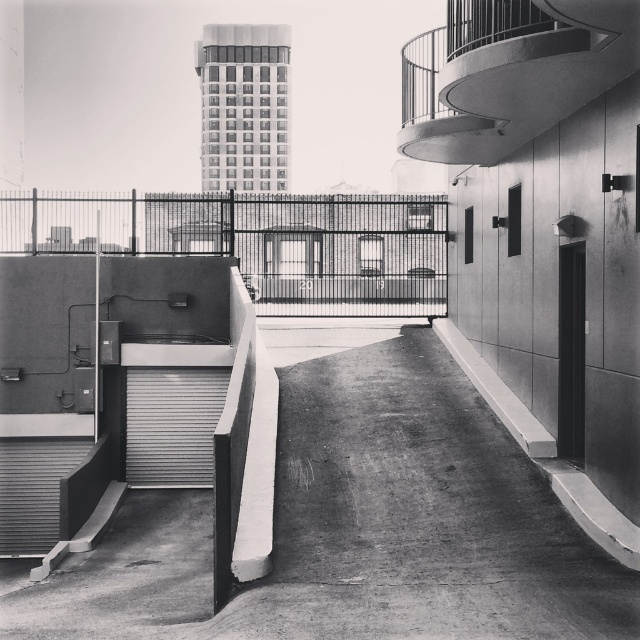
Question: Which point appears farthest from the camera in this image?

Choices:
 (A) (136, 477)
 (B) (467, 100)
 (C) (28, 508)

Answer: (A)

Question: Is metallic spiral staircase at upper right positioned in front of metallic gray stairwell at lower left?

Choices:
 (A) no
 (B) yes

Answer: (B)

Question: Can you confirm if metallic spiral staircase at upper right is thinner than metallic gray stairwell at lower left?

Choices:
 (A) no
 (B) yes

Answer: (B)

Question: Which object is farther from the camera taking this photo?

Choices:
 (A) metallic gray stairwell at lower left
 (B) metallic spiral staircase at upper right

Answer: (A)

Question: Is metallic spiral staircase at upper right wider than metallic silver door at lower left?

Choices:
 (A) no
 (B) yes

Answer: (A)

Question: Among these objects, which one is farthest from the camera?

Choices:
 (A) metallic gray stairwell at lower left
 (B) metallic spiral staircase at upper right
 (C) metallic silver door at lower left

Answer: (C)